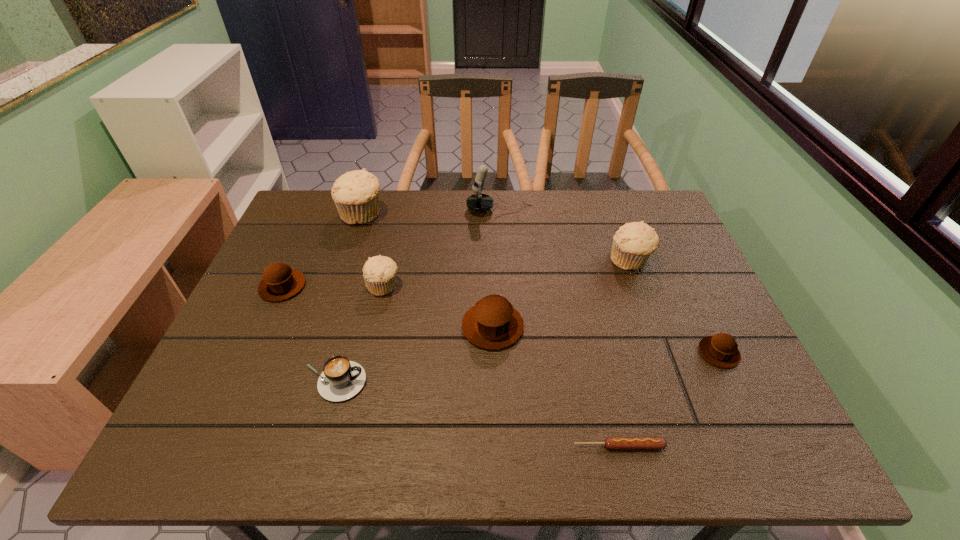
You are a GUI agent. You are given a task and a screenshot of the screen. Output one action in this format:
    pyautogui.click(x=<x>, y=<y>)
    Task: Click on the white microphone
    The height and width of the screenshot is (540, 960).
    Given the screenshot: What is the action you would take?
    pyautogui.click(x=479, y=202)

This screenshot has height=540, width=960. I want to click on the farthest muffin, so click(x=355, y=194).

Locate an element on the screen. Image resolution: width=960 pixels, height=540 pixels. the farthest beige muffin is located at coordinates (355, 194).

At what (x,y) coordinates should I click in order to perform the action: click on the rightmost beige muffin. Please return your answer as a coordinate pair (x, y). The width and height of the screenshot is (960, 540). Looking at the image, I should click on tap(633, 243).

This screenshot has height=540, width=960. What are the coordinates of `the eighth object from left to right` in the screenshot? It's located at (633, 243).

You are a GUI agent. You are given a task and a screenshot of the screen. Output one action in this format:
    pyautogui.click(x=<x>, y=<y>)
    Task: Click on the second beige muffin from left to right
    This screenshot has height=540, width=960.
    Given the screenshot: What is the action you would take?
    pyautogui.click(x=379, y=272)

The height and width of the screenshot is (540, 960). Find the location of `the smallest beige muffin`. the smallest beige muffin is located at coordinates (379, 272).

At what (x,y) coordinates should I click in order to perform the action: click on the fourth muffin from left to right. Please return your answer as a coordinate pair (x, y). This screenshot has width=960, height=540. Looking at the image, I should click on (493, 323).

Identify the location of the biggest brown muffin. Image resolution: width=960 pixels, height=540 pixels. (493, 323).

The height and width of the screenshot is (540, 960). In order to click on the second shortest muffin in this screenshot , I will do `click(279, 282)`.